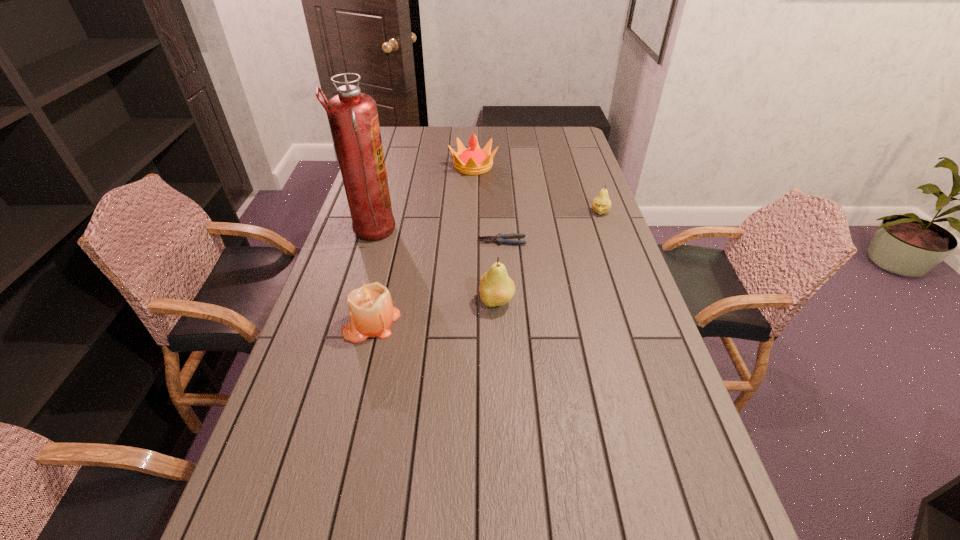
At what (x,y) coordinates should I click in order to perform the action: click on free region at the near edge of the desktop. Please return your answer as a coordinate pair (x, y). The height and width of the screenshot is (540, 960). Looking at the image, I should click on (559, 490).

Find the location of `vacant space at the left edge of the desktop`. vacant space at the left edge of the desktop is located at coordinates (321, 365).

Identify the location of blank space at the right edge of the desktop. coord(643,319).

At what (x,y) coordinates should I click in order to perform the action: click on free spot at the far right corner of the desktop. Please return your answer as a coordinate pair (x, y). Image resolution: width=960 pixels, height=540 pixels. Looking at the image, I should click on (571, 137).

Identify the location of vacant area at the near right corner. (634, 475).

Locate an element on the screen. free space between the candle and the tallest object is located at coordinates coord(372,278).

The height and width of the screenshot is (540, 960). What are the coordinates of `free spot between the shortest object and the candle` in the screenshot? It's located at (437, 282).

Identify the location of free space between the taller pear and the fire extinguisher. (434, 267).

Find the location of a particular element. The width and height of the screenshot is (960, 540). free space that is in between the farthest object and the pliers is located at coordinates (488, 204).

Identify the location of vacant region between the shorter pear and the crown. (537, 190).